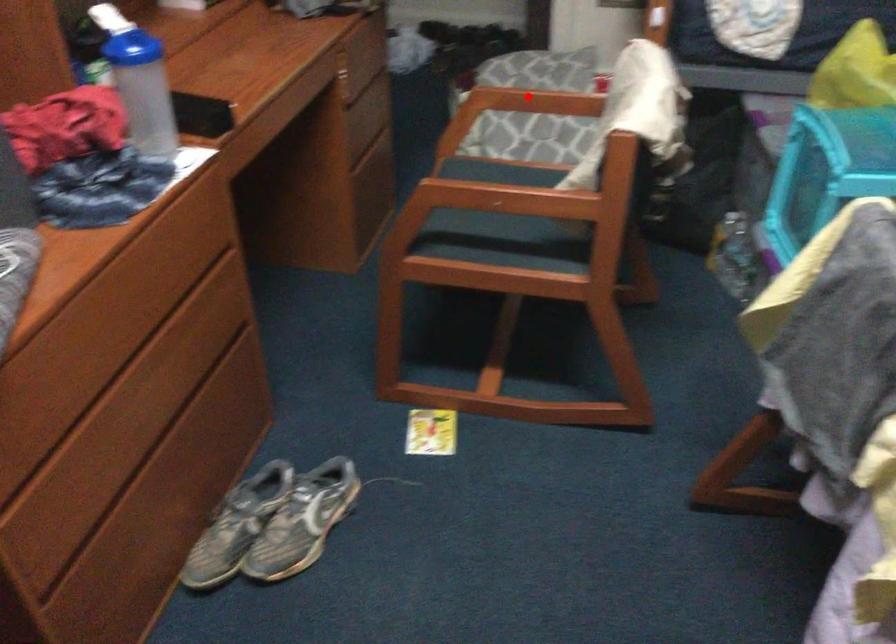
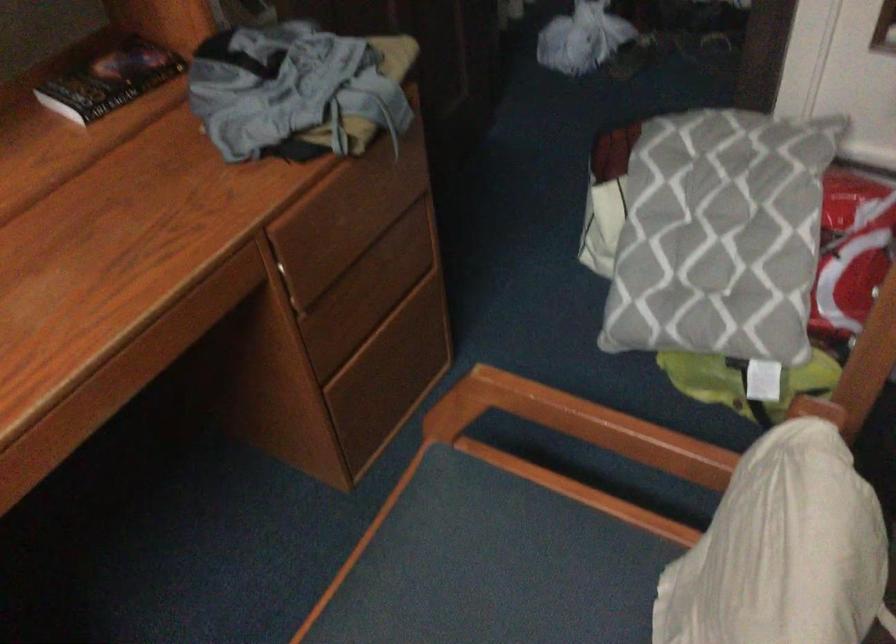
Locate, in the second image, the point that corresponds to the highlighted location in the first image.

(579, 424)